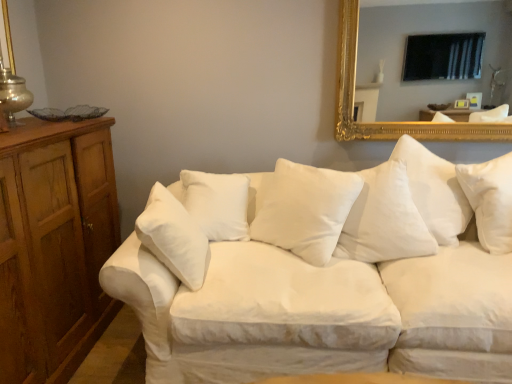
This screenshot has width=512, height=384. What are the coordinates of `wooden dresser at left` in the screenshot? It's located at (54, 245).

Image resolution: width=512 pixels, height=384 pixels. Describe the element at coordinates (54, 245) in the screenshot. I see `wooden dresser at left` at that location.

What do you see at coordinates (304, 209) in the screenshot?
I see `white soft cushion at center` at bounding box center [304, 209].

Image resolution: width=512 pixels, height=384 pixels. What are the coordinates of `shiny metallic lamp at left` in the screenshot? It's located at (13, 94).

This screenshot has height=384, width=512. Identify the location of white cotton couch at center. [x=325, y=272].

Could you tell me if white soft cushion at center is facing wooden dresser at left?

No, white soft cushion at center is not oriented towards wooden dresser at left.

From a real-world perspective, which is physically below, white soft cushion at center or wooden dresser at left?

wooden dresser at left.

Who is smaller, white soft cushion at center or wooden dresser at left?

white soft cushion at center.

Are white soft cushion at center and wooden dresser at left beside each other?

No, white soft cushion at center is not making contact with wooden dresser at left.

Locate an element on the screen. pillow on the right of wooden dresser at left is located at coordinates (304, 209).

Who is more distant, wooden dresser at left or white soft cushion at center?

white soft cushion at center is behind.

Could you tell me if wooden dresser at left is facing white soft cushion at center?

Yes, wooden dresser at left is aimed at white soft cushion at center.

Does wooden dresser at left have a greater height compared to white soft cushion at center?

Indeed, wooden dresser at left has a greater height compared to white soft cushion at center.

Is wooden dresser at left oriented towards shiny metallic lamp at left?

No, wooden dresser at left is not aimed at shiny metallic lamp at left.

Which object is further away from the camera taking this photo, wooden dresser at left or shiny metallic lamp at left?

shiny metallic lamp at left is behind.

What's the angular difference between wooden dresser at left and shiny metallic lamp at left's facing directions?

The angle between the facing direction of wooden dresser at left and the facing direction of shiny metallic lamp at left is 0.000388 degrees.

Does wooden dresser at left appear on the right side of shiny metallic lamp at left?

Yes.

Is wooden dresser at left next to white cotton couch at center?

They are not placed beside each other.

From a real-world perspective, which object rests below the other?

white cotton couch at center.

Considering the sizes of objects wooden dresser at left and white cotton couch at center in the image provided, who is bigger, wooden dresser at left or white cotton couch at center?

white cotton couch at center.

From the image's perspective, is shiny metallic lamp at left beneath gold-framed mirror at upper right?

Yes.

Which of these two, shiny metallic lamp at left or gold-framed mirror at upper right, is thinner?

gold-framed mirror at upper right is thinner.

Which object is positioned more to the left, shiny metallic lamp at left or gold-framed mirror at upper right?

From the viewer's perspective, shiny metallic lamp at left appears more on the left side.

Between white soft cushion at center and gold-framed mirror at upper right, which one has larger width?

white soft cushion at center.

Identify the location of pillow on the left of the gold-framed mirror at upper right. The height and width of the screenshot is (384, 512). (304, 209).

Are white soft cushion at center and gold-framed mirror at upper right making contact?

white soft cushion at center and gold-framed mirror at upper right are clearly separated.

From the image's perspective, is white soft cushion at center positioned above or below gold-framed mirror at upper right?

Clearly, from the image's perspective, white soft cushion at center is below gold-framed mirror at upper right.

Is white cotton couch at center oriented away from shiny metallic lamp at left?

No, white cotton couch at center is not facing the opposite direction of shiny metallic lamp at left.

Who is bigger, white cotton couch at center or shiny metallic lamp at left?

white cotton couch at center.

The image size is (512, 384). I want to click on table lamp above the white cotton couch at center (from the image's perspective), so click(x=13, y=94).

Considering the positions of points (157, 314) and (8, 98), is point (157, 314) farther from camera compared to point (8, 98)?

No, (157, 314) is in front of (8, 98).

Locate an element on the screen. dresser in front of the white soft cushion at center is located at coordinates (54, 245).

I want to click on dresser below the white soft cushion at center (from the image's perspective), so click(x=54, y=245).

Estimate the real-world distances between objects in this image. Which object is further from wooden dresser at left, shiny metallic lamp at left or white cotton couch at center?

The object further to wooden dresser at left is white cotton couch at center.

From the picture: Considering their positions, is shiny metallic lamp at left positioned closer to gold-framed mirror at upper right than white cotton couch at center?

white cotton couch at center lies closer to gold-framed mirror at upper right than the other object.

Which object lies further to the anchor point white cotton couch at center, shiny metallic lamp at left or wooden dresser at left?

shiny metallic lamp at left is positioned further to the anchor white cotton couch at center.

From the image, which object appears to be farther from shiny metallic lamp at left, wooden dresser at left or gold-framed mirror at upper right?

gold-framed mirror at upper right is positioned further to the anchor shiny metallic lamp at left.

From the image, which object appears to be nearer to white soft cushion at center, wooden dresser at left or shiny metallic lamp at left?

The object closer to white soft cushion at center is wooden dresser at left.

Which object lies nearer to the anchor point white cotton couch at center, gold-framed mirror at upper right or wooden dresser at left?

Among the two, wooden dresser at left is located nearer to white cotton couch at center.

Estimate the real-world distances between objects in this image. Which object is closer to wooden dresser at left, gold-framed mirror at upper right or white soft cushion at center?

white soft cushion at center.

Looking at this image, when comparing their distances from shiny metallic lamp at left, does gold-framed mirror at upper right or wooden dresser at left seem closer?

wooden dresser at left lies closer to shiny metallic lamp at left than the other object.

Locate an element on the screen. The image size is (512, 384). pillow located between wooden dresser at left and gold-framed mirror at upper right in the left-right direction is located at coordinates (x=304, y=209).

You are a GUI agent. You are given a task and a screenshot of the screen. Output one action in this format:
    pyautogui.click(x=<x>, y=<y>)
    Task: Click on the studio couch situated between shiny metallic lamp at left and gold-framed mirror at upper right from left to right
    
    Given the screenshot: What is the action you would take?
    pyautogui.click(x=325, y=272)

At what (x,y) coordinates should I click in order to perform the action: click on pillow between gold-framed mirror at upper right and white cotton couch at center from top to bottom. Please return your answer as a coordinate pair (x, y). This screenshot has height=384, width=512. Looking at the image, I should click on pos(304,209).

Find the location of a particular element. dresser located between shiny metallic lamp at left and gold-framed mirror at upper right in the left-right direction is located at coordinates (54, 245).